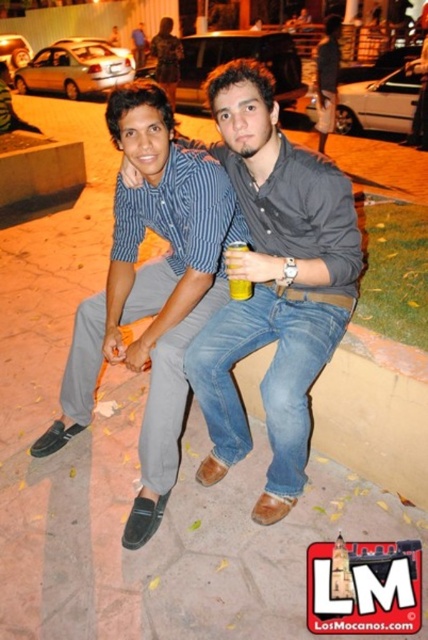
Can you confirm if matte blue shirt at center is wider than yellow plastic cup at center?

Indeed, matte blue shirt at center has a greater width compared to yellow plastic cup at center.

Does matte blue shirt at center have a lesser width compared to yellow plastic cup at center?

No, matte blue shirt at center is not thinner than yellow plastic cup at center.

Between point (121, 273) and point (232, 246), which one is positioned in front?

Positioned in front is point (232, 246).

You are a GUI agent. You are given a task and a screenshot of the screen. Output one action in this format:
    pyautogui.click(x=<x>, y=<y>)
    Task: Click on the matte blue shirt at center
    The height and width of the screenshot is (640, 428).
    Given the screenshot: What is the action you would take?
    pyautogui.click(x=151, y=291)

Does point (246, 188) come in front of point (137, 214)?

That is True.

Identify the location of blue jeans at center. (273, 284).

Is point (278, 276) closer to camera compared to point (139, 122)?

Yes, point (278, 276) is closer to viewer.

At what (x,y) coordinates should I click in order to perform the action: click on blue jeans at center. Please return your answer as a coordinate pair (x, y). Looking at the image, I should click on (273, 284).

Does blue jeans at center have a greater height compared to yellow plastic cup at center?

Indeed, blue jeans at center has a greater height compared to yellow plastic cup at center.

Which is in front, point (208, 381) or point (250, 285)?

Point (250, 285) is in front.

Is point (256, 154) more distant than point (240, 292)?

No, (256, 154) is closer to viewer.

Locate an element on the screen. blue jeans at center is located at coordinates (273, 284).